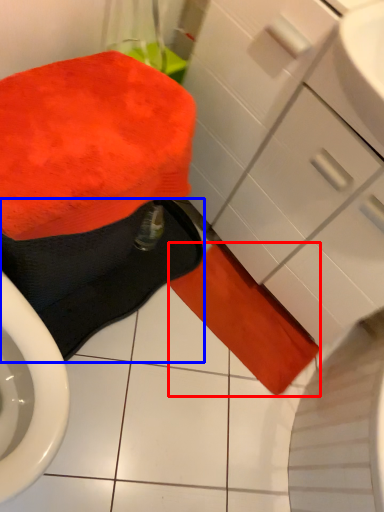
Question: Which point is further to the camera, bath towel (highlighted by a red box) or bath towel (highlighted by a blue box)?

Choices:
 (A) bath towel
 (B) bath towel

Answer: (A)